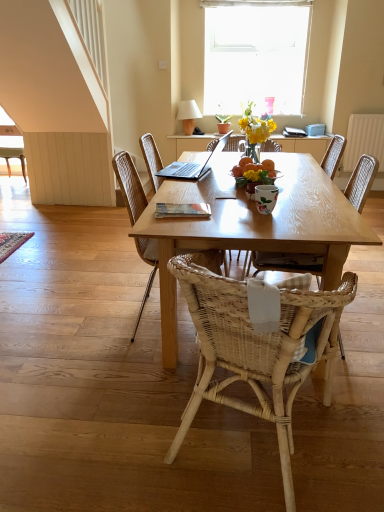
Question: Can you confirm if wooden book at center is positioned to the left of white glass window at upper center?

Choices:
 (A) no
 (B) yes

Answer: (B)

Question: Does wooden book at center have a greater width compared to white glass window at upper center?

Choices:
 (A) yes
 (B) no

Answer: (B)

Question: Is wooden book at center positioned with its back to white glass window at upper center?

Choices:
 (A) no
 (B) yes

Answer: (A)

Question: Is white glass window at upper center inside wooden book at center?

Choices:
 (A) yes
 (B) no

Answer: (B)

Question: Is wooden book at center oriented towards white glass window at upper center?

Choices:
 (A) no
 (B) yes

Answer: (A)

Question: Is wooden book at center smaller than white glass window at upper center?

Choices:
 (A) yes
 (B) no

Answer: (A)

Question: Is woven wood chair at center, which appears as the fourth chair when viewed from the back, smaller than white glossy coffee cup at center?

Choices:
 (A) yes
 (B) no

Answer: (B)

Question: From a real-world perspective, is woven wood chair at center, which appears as the fourth chair when viewed from the back, over white glossy coffee cup at center?

Choices:
 (A) no
 (B) yes

Answer: (A)

Question: Does woven wood chair at center, the first chair in the front-to-back sequence, appear on the right side of white glossy coffee cup at center?

Choices:
 (A) no
 (B) yes

Answer: (A)

Question: Can you confirm if woven wood chair at center, positioned as the 3th chair in left-to-right order, is bigger than white glossy coffee cup at center?

Choices:
 (A) yes
 (B) no

Answer: (A)

Question: Is woven wood chair at center, the first chair in the front-to-back sequence, taller than white glossy coffee cup at center?

Choices:
 (A) yes
 (B) no

Answer: (A)

Question: Is woven wood chair at center, the first chair in the front-to-back sequence, facing towards white glossy coffee cup at center?

Choices:
 (A) no
 (B) yes

Answer: (B)

Question: From the image's perspective, is white textured curtain at upper center above white glossy coffee cup at center?

Choices:
 (A) yes
 (B) no

Answer: (A)